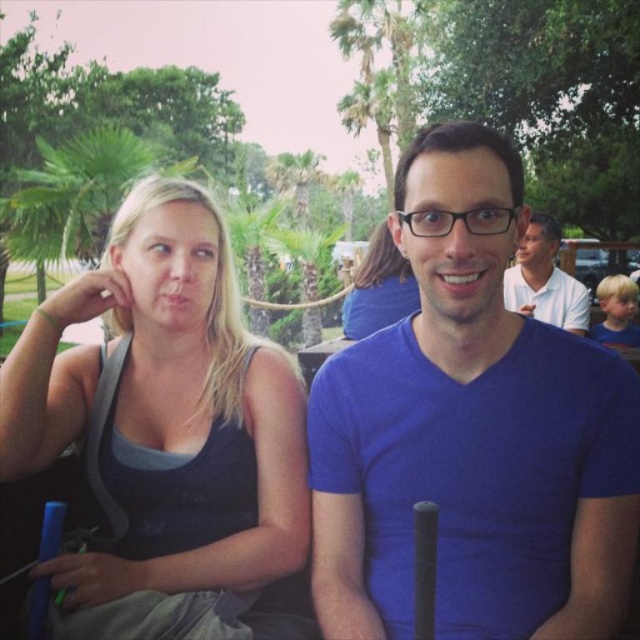
You are a fashion designer observing this image and need to determine the spatial relationship between the blue matte shirt at center and the white cotton polo shirt at upper right. Which one is taller?

The blue matte shirt at center is much taller than the white cotton polo shirt at upper right according to the description.

You are standing 5 feet away from the camera. You want to hand a small note to the person wearing the matte black tank top at left without moving closer than 1 foot to the camera. Is this possible?

The matte black tank top at left and camera are 3.71 feet apart. Since you are 5 feet away from the camera, the distance between you and the matte black tank top at left would be 5 feet minus 3.71 feet, which is approximately 1.29 feet. This means you can hand the note without moving closer than 1 foot to the camera.

You are a photographer adjusting your camera settings to focus on the blue matte shirt at center and the matte blue tank top at center. Which one should you focus on first to ensure both are in sharp focus?

You should focus on the blue matte shirt at center first since it is closer to the viewer than the matte blue tank top at center, allowing the camera to adjust depth of field to include both.